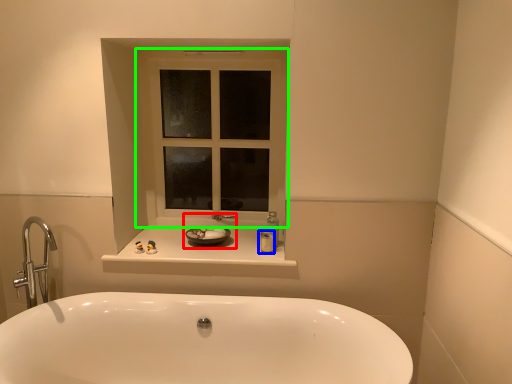
Question: Considering the real-world distances, which object is farthest from sink (highlighted by a red box)? toiletry (highlighted by a blue box) or window (highlighted by a green box)?

Choices:
 (A) toiletry
 (B) window

Answer: (B)